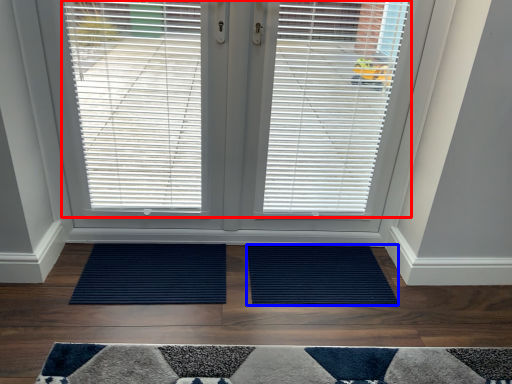
Question: Which point is further to the camera, window blind (highlighted by a red box) or doormat (highlighted by a blue box)?

Choices:
 (A) window blind
 (B) doormat

Answer: (B)